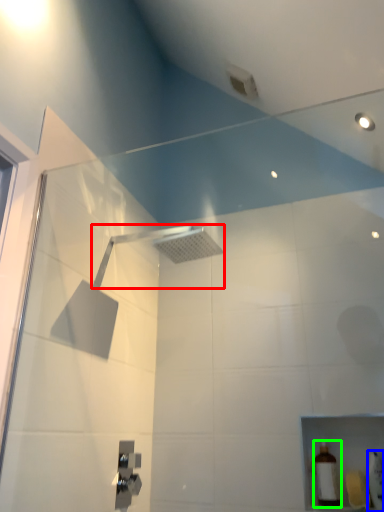
Question: Estimate the real-world distances between objects in this image. Which object is farther from shower (highlighted by a red box), toiletry (highlighted by a blue box) or toiletry (highlighted by a green box)?

Choices:
 (A) toiletry
 (B) toiletry

Answer: (A)